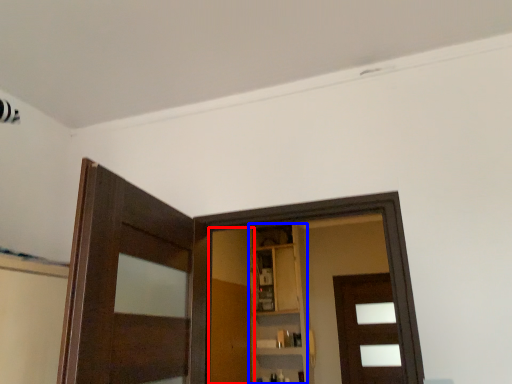
Question: Which object is closer to the camera taking this photo, barn door (highlighted by a red box) or cabinetry (highlighted by a blue box)?

Choices:
 (A) barn door
 (B) cabinetry

Answer: (A)